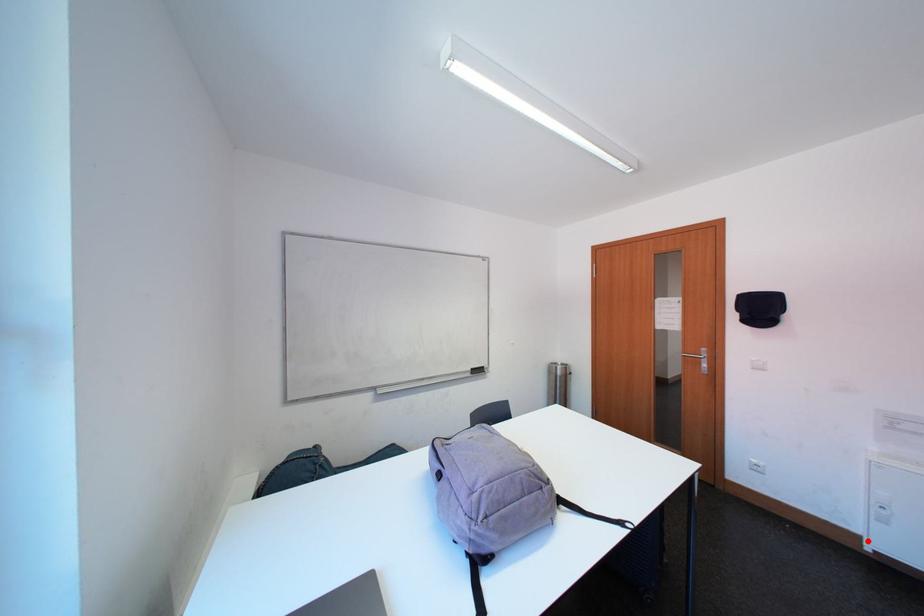
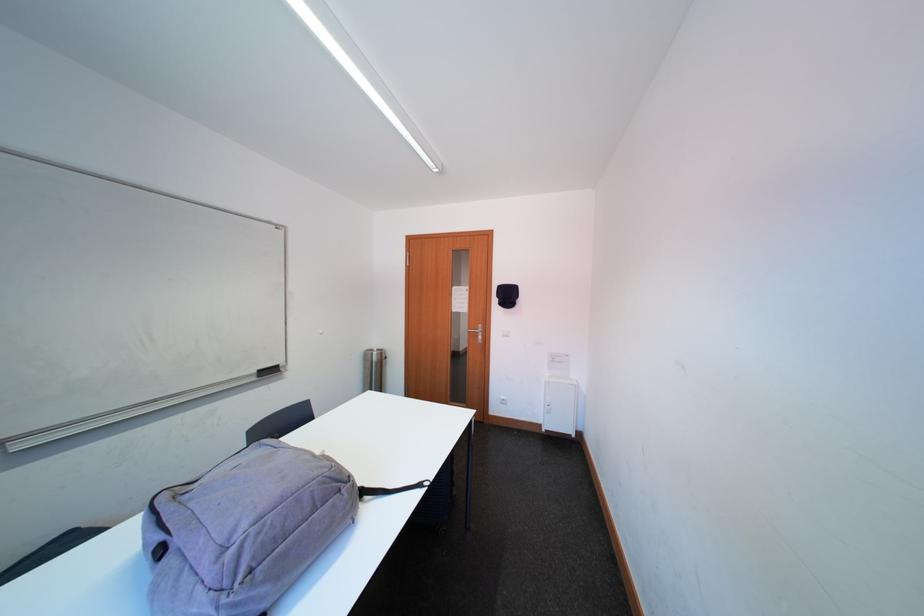
The point at the highlighted location is marked in the first image. Where is the corresponding point in the second image?

(551, 429)